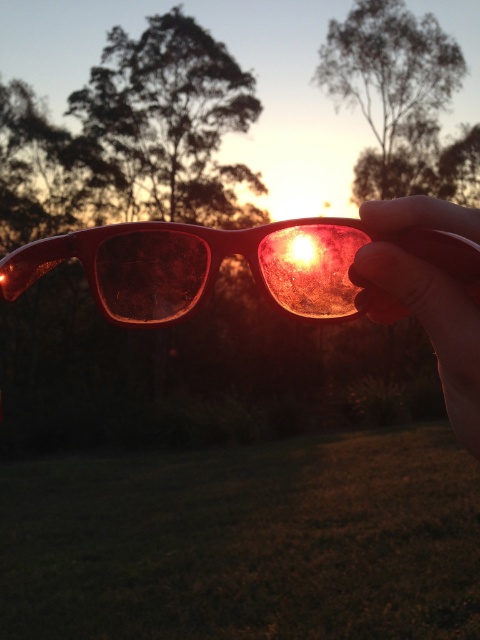
You are a photographer trying to capture the sunset through the matte plastic goggles at center. You are holding the matte plastic hand at center steady. Can you focus on the sunset without moving your hand?

The matte plastic goggles at center and matte plastic hand at center are 2.90 inches apart from each other. Since the goggles are held by the hand, moving the hand would also move the goggles, making it difficult to focus on the sunset without moving your hand.

You are a photographer trying to capture the sunset through the matte plastic goggles at center. Based on their position at point (x=230, y=253), where should you aim your camera to ensure the goggles are centered in the frame?

You should aim your camera directly at the point (x=230, y=253) where the matte plastic goggles at center are located to ensure they are centered in the frame.